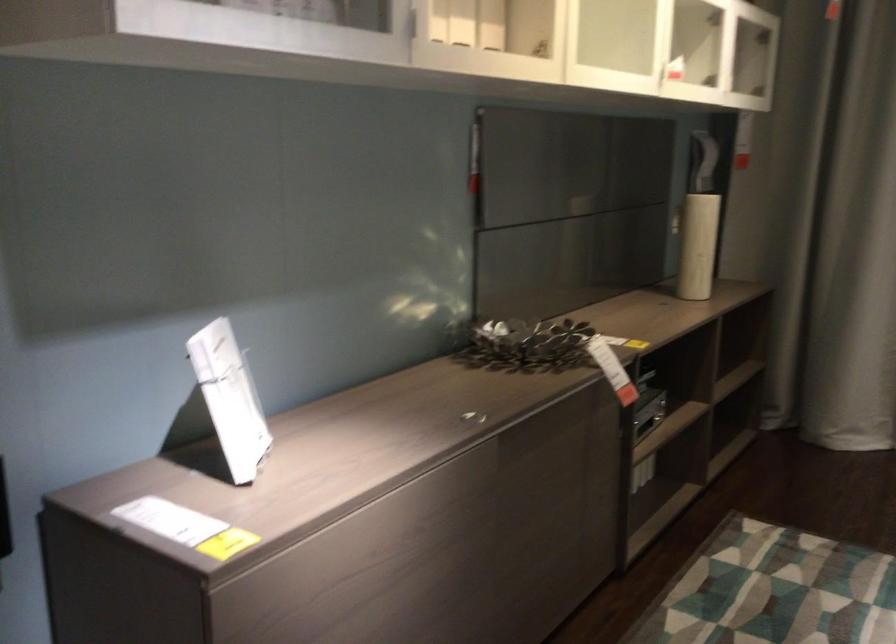
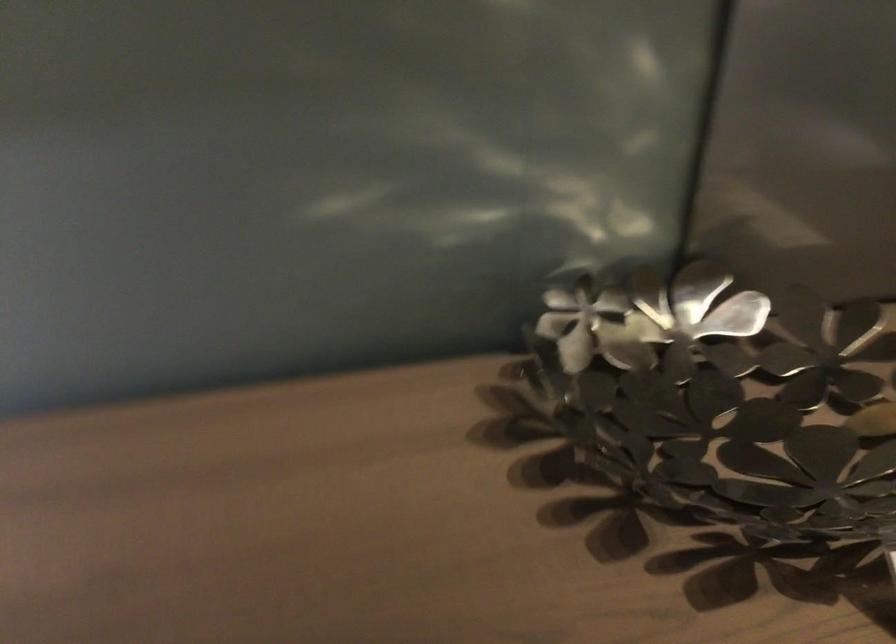
The point at [512,351] is marked in the first image. Where is the corresponding point in the second image?

(721, 399)